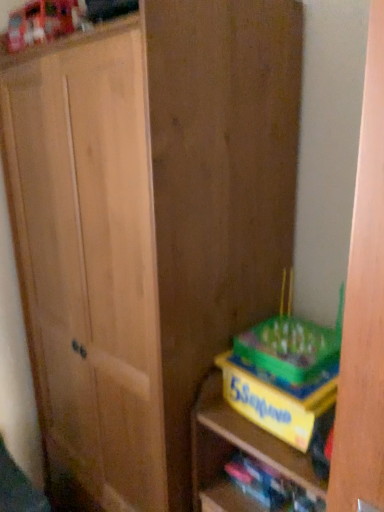
What do you see at coordinates (277, 399) in the screenshot? This screenshot has width=384, height=512. I see `yellow cardboard game box at lower right` at bounding box center [277, 399].

You are a GUI agent. You are given a task and a screenshot of the screen. Output one action in this format:
    pyautogui.click(x=<x>, y=<y>)
    Task: Click on the yellow cardboard game box at lower right
    Image resolution: width=384 pixels, height=512 pixels.
    Given the screenshot: What is the action you would take?
    pyautogui.click(x=277, y=399)

Locate an element on the screen. The width and height of the screenshot is (384, 512). yellow cardboard game box at lower right is located at coordinates (277, 399).

Considering the positions of point (244, 394) and point (216, 372), is point (244, 394) closer or farther from the camera than point (216, 372)?

Point (244, 394) appears to be closer to the viewer than point (216, 372).

Does yellow cardboard game box at lower right lie behind yellow cardboard game at lower right?

Yes, it is.

Find the location of `cabinetry above the yellow cardboard game at lower right (from a real-world perspective)`. cabinetry above the yellow cardboard game at lower right (from a real-world perspective) is located at coordinates (277, 399).

Can you confirm if yellow cardboard game box at lower right is taller than yellow cardboard game at lower right?

In fact, yellow cardboard game box at lower right may be shorter than yellow cardboard game at lower right.

Is yellow cardboard game box at lower right at the back of yellow cardboard game at lower right?

No, yellow cardboard game box at lower right is not at the back of yellow cardboard game at lower right.

Considering the positions of objects yellow cardboard game at lower right and yellow cardboard game box at lower right in the image provided, who is more to the right, yellow cardboard game at lower right or yellow cardboard game box at lower right?

yellow cardboard game box at lower right.

Is yellow cardboard game at lower right positioned behind yellow cardboard game box at lower right?

That is False.

Locate an element on the screen. shelf that is below the yellow cardboard game box at lower right (from the image's perspective) is located at coordinates (235, 450).

Relative to yellow cardboard book at lower right, is yellow cardboard game at lower right in front or behind?

In the image, yellow cardboard game at lower right appears in front of yellow cardboard book at lower right.

From the picture: Are yellow cardboard game at lower right and yellow cardboard book at lower right far apart?

No, yellow cardboard game at lower right is not far away from yellow cardboard book at lower right.

From a real-world perspective, is yellow cardboard game at lower right located beneath yellow cardboard book at lower right?

Indeed, from a real-world perspective, yellow cardboard game at lower right is positioned beneath yellow cardboard book at lower right.

Considering the sizes of objects yellow cardboard game at lower right and yellow cardboard book at lower right in the image provided, who is shorter, yellow cardboard game at lower right or yellow cardboard book at lower right?

Standing shorter between the two is yellow cardboard book at lower right.

In the scene shown: Which is behind, yellow cardboard game box at lower right or yellow cardboard book at lower right?

yellow cardboard book at lower right is further from the camera.

From a real-world perspective, is yellow cardboard game box at lower right positioned above or below yellow cardboard book at lower right?

From a real-world perspective, yellow cardboard game box at lower right is physically above yellow cardboard book at lower right.

Does yellow cardboard game box at lower right turn towards yellow cardboard book at lower right?

No, yellow cardboard game box at lower right is not oriented towards yellow cardboard book at lower right.

Does point (257, 421) come behind point (256, 476)?

No, (257, 421) is in front of (256, 476).

How far apart are yellow cardboard book at lower right and yellow cardboard game box at lower right?

The distance of yellow cardboard book at lower right from yellow cardboard game box at lower right is 8.08 inches.

From the image's perspective, between yellow cardboard book at lower right and yellow cardboard game box at lower right, who is located below?

yellow cardboard book at lower right, from the image's perspective.

Would you say yellow cardboard book at lower right is a long distance from yellow cardboard game box at lower right?

No, yellow cardboard book at lower right is not far from yellow cardboard game box at lower right.

Which is more distant, [292,505] or [337,380]?

The point [292,505] is more distant.

In the scene shown: From a real-world perspective, does yellow cardboard book at lower right stand above yellow cardboard game at lower right?

Yes.

What's the angular difference between yellow cardboard book at lower right and yellow cardboard game at lower right's facing directions?

1.32 degrees separate the facing orientations of yellow cardboard book at lower right and yellow cardboard game at lower right.

Consider the image. Would you say yellow cardboard game at lower right is part of yellow cardboard book at lower right's contents?

No, yellow cardboard game at lower right is located outside of yellow cardboard book at lower right.

This screenshot has height=512, width=384. What are the coordinates of `shelf that is under the yellow cardboard book at lower right (from a real-world perspective)` in the screenshot? It's located at (235, 450).

Where is `cabinetry above the yellow cardboard game at lower right (from the image's perspective)`? This screenshot has width=384, height=512. cabinetry above the yellow cardboard game at lower right (from the image's perspective) is located at coordinates (277, 399).

Locate an element on the screen. shelf to the left of yellow cardboard game box at lower right is located at coordinates (235, 450).

Estimate the real-world distances between objects in this image. Which object is closer to yellow cardboard game box at lower right, yellow cardboard book at lower right or yellow cardboard game at lower right?

Among the two, yellow cardboard game at lower right is located nearer to yellow cardboard game box at lower right.

Which object lies nearer to the anchor point yellow cardboard game at lower right, yellow cardboard game box at lower right or yellow cardboard book at lower right?

yellow cardboard game box at lower right is positioned closer to the anchor yellow cardboard game at lower right.

When comparing their distances from yellow cardboard game at lower right, does yellow cardboard book at lower right or yellow cardboard game box at lower right seem further?

yellow cardboard book at lower right lies further to yellow cardboard game at lower right than the other object.

When comparing their distances from yellow cardboard book at lower right, does yellow cardboard game at lower right or yellow cardboard game box at lower right seem further?

yellow cardboard game box at lower right is positioned further to the anchor yellow cardboard book at lower right.

Considering their positions, is yellow cardboard game box at lower right positioned further to yellow cardboard book at lower right than yellow cardboard game at lower right?

yellow cardboard game box at lower right is positioned further to the anchor yellow cardboard book at lower right.

From the image, which object appears to be nearer to yellow cardboard game box at lower right, yellow cardboard game at lower right or yellow cardboard book at lower right?

yellow cardboard game at lower right lies closer to yellow cardboard game box at lower right than the other object.

Find the location of a particular element. The image size is (384, 512). book between yellow cardboard game box at lower right and yellow cardboard game at lower right from top to bottom is located at coordinates (269, 485).